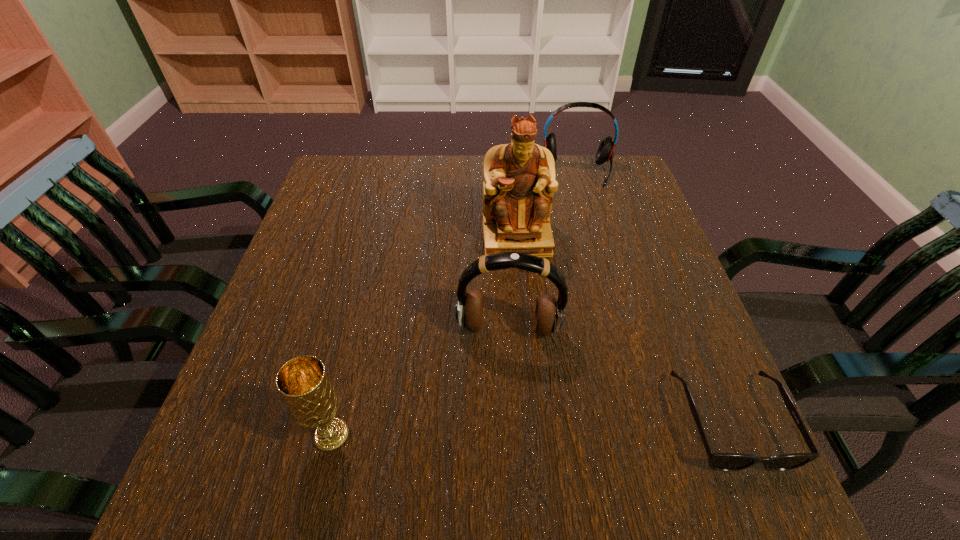
Image resolution: width=960 pixels, height=540 pixels. What are the coordinates of `free space at the right edge of the desktop` in the screenshot? It's located at (650, 350).

Locate an element on the screen. The height and width of the screenshot is (540, 960). vacant point at the far left corner is located at coordinates (343, 194).

I want to click on free space at the far right corner of the desktop, so click(x=596, y=194).

Locate an element on the screen. blank region between the figurine and the chalice is located at coordinates coord(424,337).

You are a GUI agent. You are given a task and a screenshot of the screen. Output one action in this format:
    pyautogui.click(x=<x>, y=<y>)
    Task: Click on the free point between the left headset and the sunglasses
    This screenshot has height=540, width=960.
    Given the screenshot: What is the action you would take?
    pyautogui.click(x=619, y=375)

Where is `free space between the shortest object and the leftmost object`? free space between the shortest object and the leftmost object is located at coordinates (531, 428).

Find the location of a particular element. This screenshot has width=960, height=540. empty space between the farther headset and the chalice is located at coordinates (454, 303).

Where is `vacant region between the shortest object and the third nearest object`? The image size is (960, 540). vacant region between the shortest object and the third nearest object is located at coordinates (619, 375).

What are the coordinates of `empty space that is in between the leftmost object and the figurine` in the screenshot? It's located at (424, 337).

You are a GUI agent. You are given a task and a screenshot of the screen. Output one action in this format:
    pyautogui.click(x=<x>, y=<y>)
    Task: Click on the unoccupied area between the farther headset and the shortest object
    The height and width of the screenshot is (540, 960).
    Given the screenshot: What is the action you would take?
    pyautogui.click(x=654, y=295)